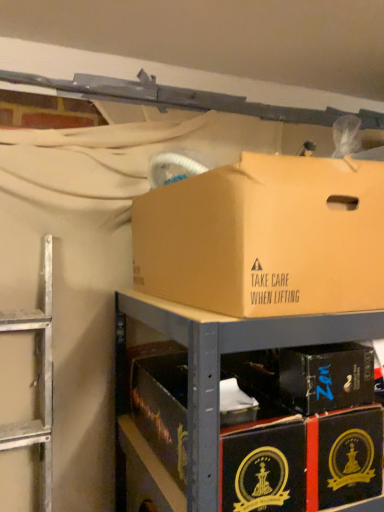
Question: Is black cardboard boxes at lower right taller than brown cardboard box at upper center, which is the second box from bottom to top?

Choices:
 (A) yes
 (B) no

Answer: (B)

Question: Are black cardboard boxes at lower right and brown cardboard box at upper center, which is the second box from bottom to top, located far from each other?

Choices:
 (A) no
 (B) yes

Answer: (A)

Question: From a real-world perspective, is black cardboard boxes at lower right located beneath brown cardboard box at upper center, marked as the 1th box in a top-to-bottom arrangement?

Choices:
 (A) no
 (B) yes

Answer: (B)

Question: Considering the relative sizes of black cardboard boxes at lower right and brown cardboard box at upper center, marked as the 1th box in a top-to-bottom arrangement, in the image provided, is black cardboard boxes at lower right wider than brown cardboard box at upper center, marked as the 1th box in a top-to-bottom arrangement,?

Choices:
 (A) no
 (B) yes

Answer: (B)

Question: Is black cardboard boxes at lower right not within brown cardboard box at upper center, which is the second box from bottom to top?

Choices:
 (A) no
 (B) yes

Answer: (B)

Question: Is black cardboard boxes at lower right positioned before brown cardboard box at upper center, which is the second box from bottom to top?

Choices:
 (A) no
 (B) yes

Answer: (A)

Question: Does black cardboard boxes at lower right have a smaller size compared to black cardboard box at center, the second box viewed from the top?

Choices:
 (A) yes
 (B) no

Answer: (B)

Question: Could you tell me if black cardboard boxes at lower right is turned towards black cardboard box at center, which is the 1th box from bottom to top?

Choices:
 (A) no
 (B) yes

Answer: (A)

Question: Does black cardboard boxes at lower right have a lesser width compared to black cardboard box at center, the second box viewed from the top?

Choices:
 (A) yes
 (B) no

Answer: (B)

Question: Is black cardboard boxes at lower right not within black cardboard box at center, which is the 1th box from bottom to top?

Choices:
 (A) yes
 (B) no

Answer: (A)

Question: Is black cardboard boxes at lower right at the right side of black cardboard box at center, the second box viewed from the top?

Choices:
 (A) no
 (B) yes

Answer: (A)

Question: Is black cardboard boxes at lower right wider than black cardboard box at center, the second box viewed from the top?

Choices:
 (A) no
 (B) yes

Answer: (B)

Question: Is brown cardboard box at upper center, which is the second box from bottom to top, positioned far away from black cardboard boxes at lower right?

Choices:
 (A) yes
 (B) no

Answer: (B)